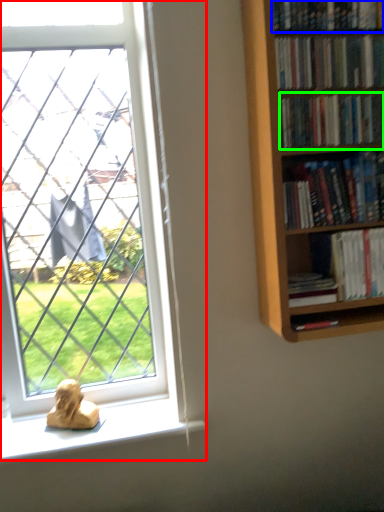
Question: Estimate the real-world distances between objects in this image. Which object is farther from window (highlighted by a red box), book (highlighted by a blue box) or book (highlighted by a green box)?

Choices:
 (A) book
 (B) book

Answer: (A)